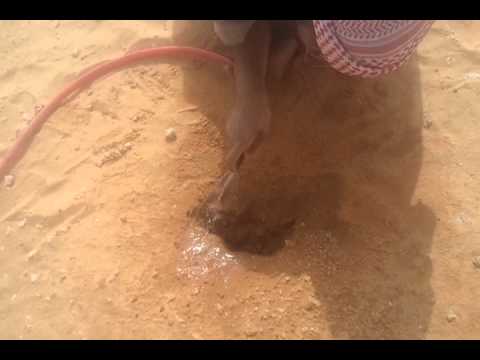
You are a GUI agent. You are given a task and a screenshot of the screen. Output one action in this format:
    pyautogui.click(x=<x>, y=<y>)
    Task: Click on the fabric
    
    Given the screenshot: What is the action you would take?
    pyautogui.click(x=370, y=36)